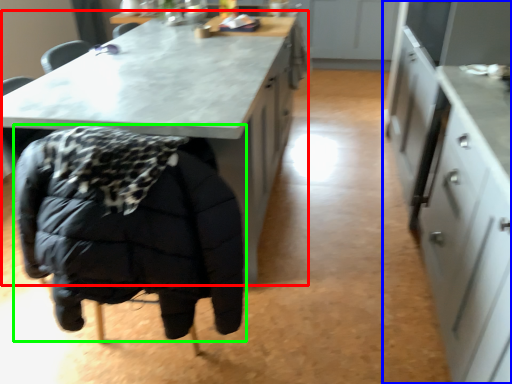
Question: Estimate the real-world distances between objects in this image. Which object is farther from table (highlighted by a red box), cabinetry (highlighted by a blue box) or jacket (highlighted by a green box)?

Choices:
 (A) cabinetry
 (B) jacket

Answer: (A)